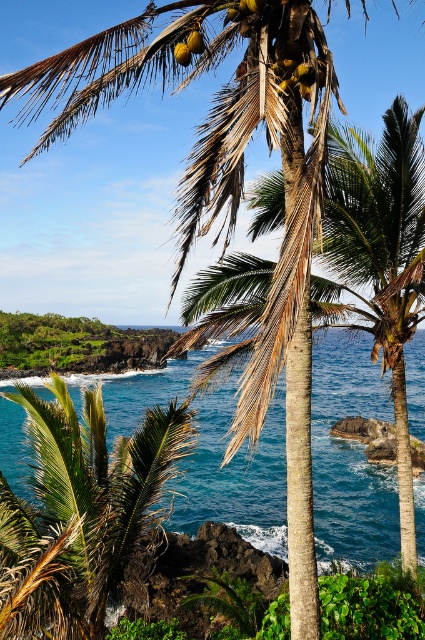
Question: Which object appears farthest from the camera in this image?

Choices:
 (A) green leafy palm tree at center
 (B) yellow matte coconut at upper center

Answer: (B)

Question: Is blue water at center wider than yellow matte coconut at upper center?

Choices:
 (A) yes
 (B) no

Answer: (A)

Question: Is green leafy palm tree at center closer to the viewer compared to yellow matte coconut at upper center?

Choices:
 (A) yes
 (B) no

Answer: (A)

Question: Which of these objects is positioned farthest from the blue water at center?

Choices:
 (A) yellow matte coconut at center
 (B) yellow matte coconut at upper center
 (C) green leafy palm tree at center
 (D) yellow coconuts at center

Answer: (B)

Question: Which of the following is the farthest from the observer?

Choices:
 (A) yellow coconuts at center
 (B) blue water at center

Answer: (B)

Question: Can you confirm if green leafy palm tree at center is thinner than yellow coconuts at center?

Choices:
 (A) yes
 (B) no

Answer: (B)